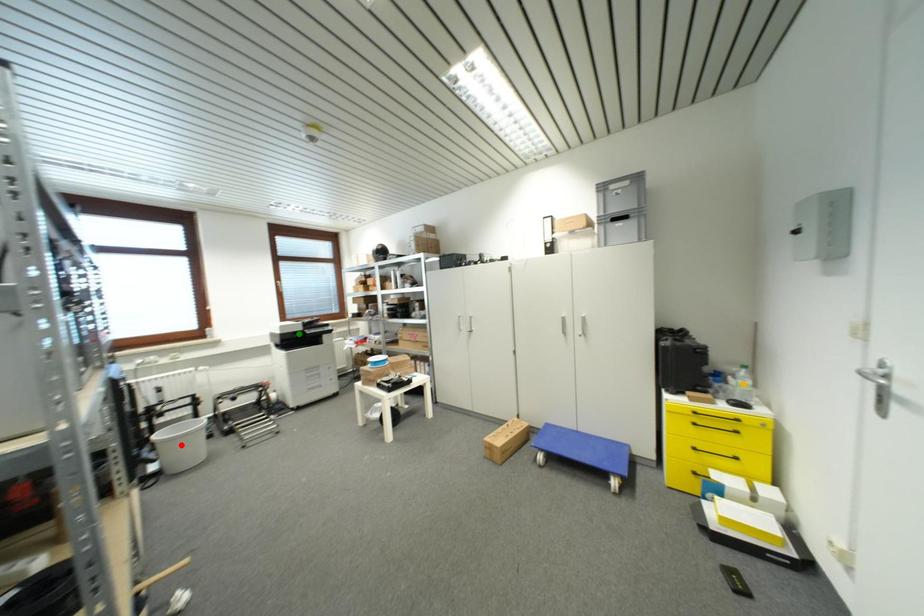
Order these from nearest to farthest:
A) orange point
B) red point
C) green point

1. orange point
2. red point
3. green point